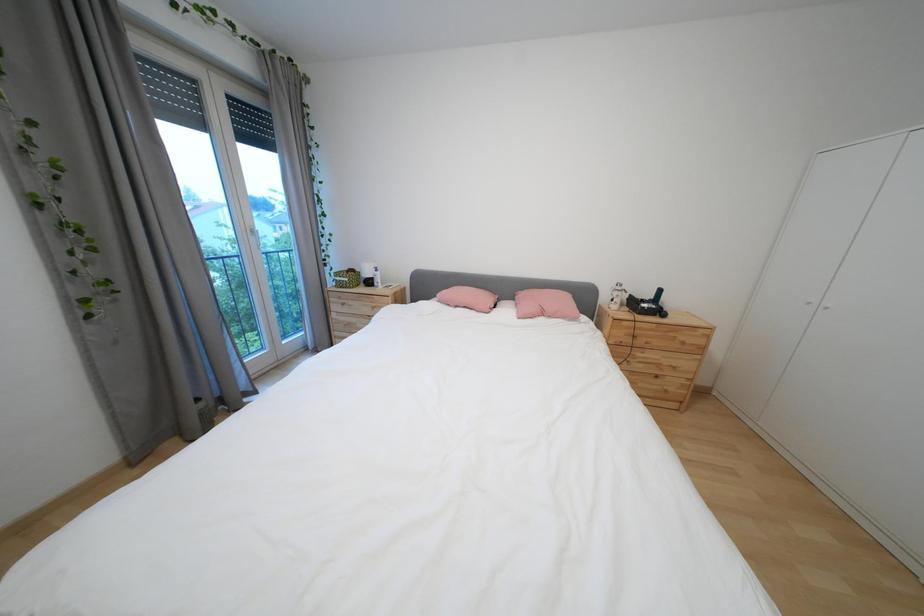
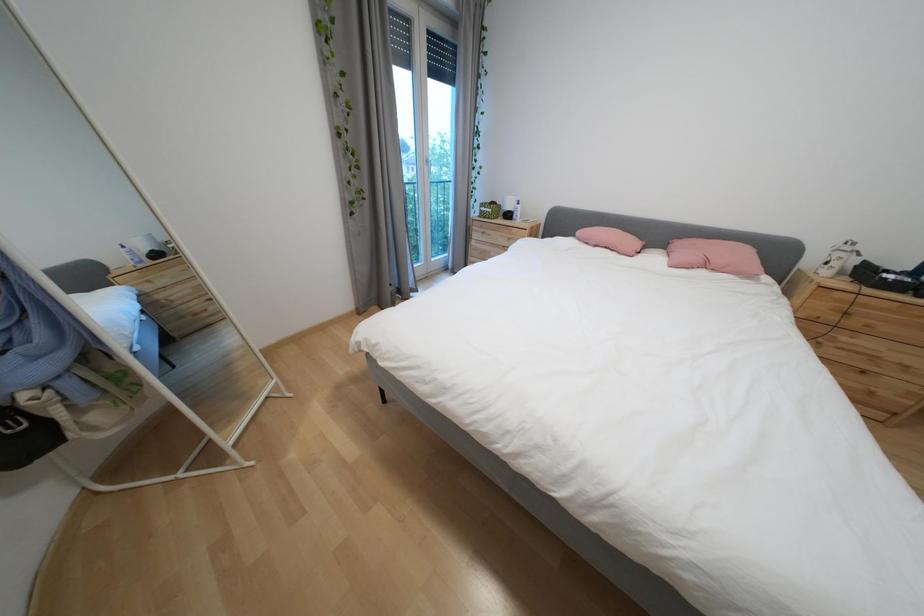
Question: The camera is either moving clockwise (left) or counter-clockwise (right) around the object. The first image is from the beginning of the video and the second image is from the end. Is the camera moving left or right when shooting the video?

Choices:
 (A) Left
 (B) Right

Answer: (B)